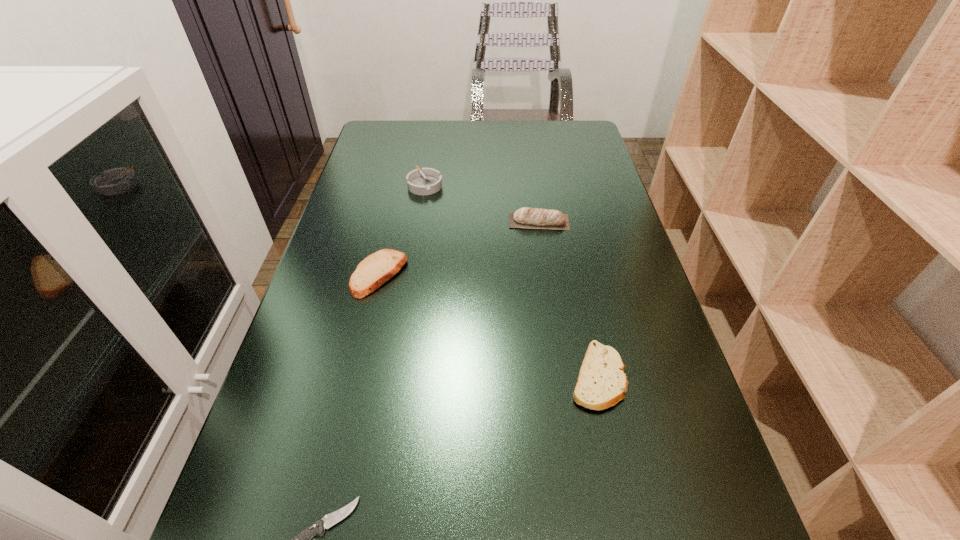
Identify which object is the nearest to the pocketknife. Please provide its 2D coordinates. Your answer should be formatted as a tuple, i.e. [(x, y)], where the tuple contains the x and y coordinates of a point satisfying the conditions above.

[(602, 383)]

The image size is (960, 540). I want to click on the closest object relative to the pocketknife, so click(x=602, y=383).

Locate an element on the screen. The height and width of the screenshot is (540, 960). pita bread that is the second closest to the farthest object is located at coordinates (376, 269).

Locate an element on the screen. The width and height of the screenshot is (960, 540). pita bread that is the nearest to the tallest pita bread is located at coordinates (376, 269).

The width and height of the screenshot is (960, 540). Identify the location of vacant area in the image that satisfies the following two spatial constraints: 1. on the back side of the farthest object; 2. on the right side of the third nearest object. (399, 185).

Locate an element on the screen. The image size is (960, 540). vacant area that satisfies the following two spatial constraints: 1. on the front side of the fourth farthest object; 2. on the left side of the third tallest object is located at coordinates (356, 376).